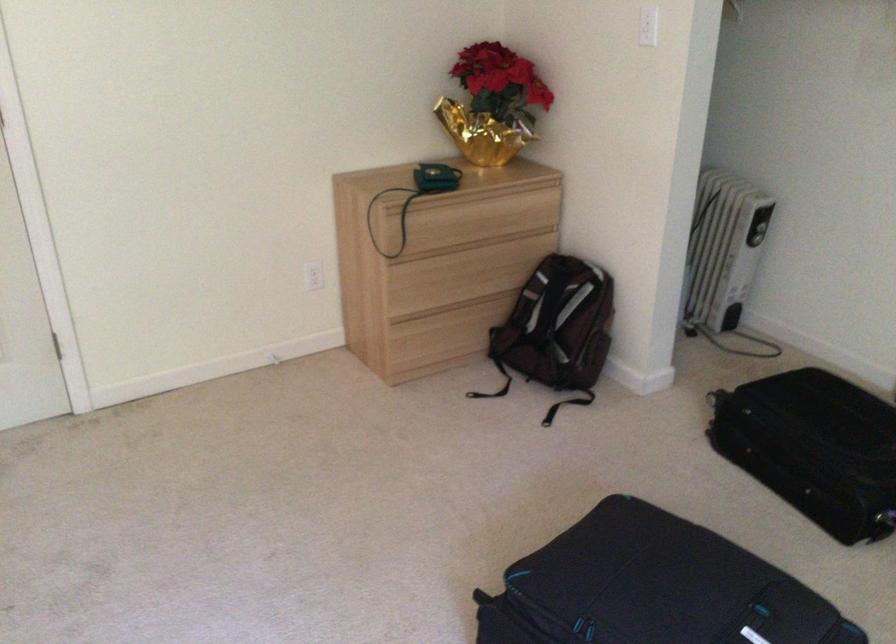
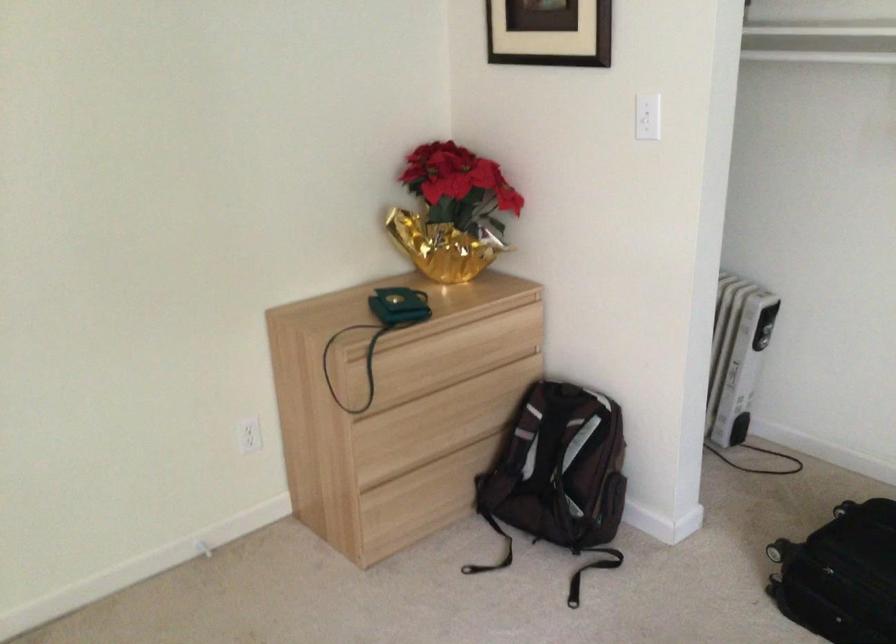
What movement of the cameraman would produce the second image?

The cameraman moved toward left, forward.